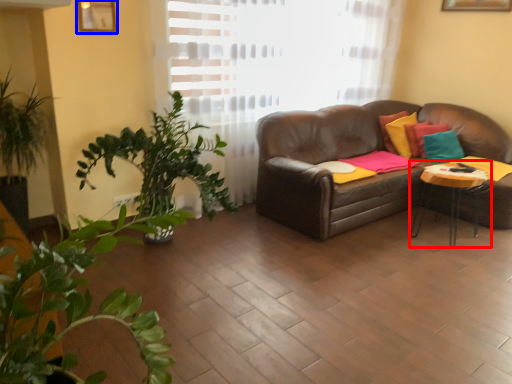
Question: Among these objects, which one is nearest to the camera, table (highlighted by a red box) or picture frame (highlighted by a blue box)?

Choices:
 (A) table
 (B) picture frame

Answer: (B)